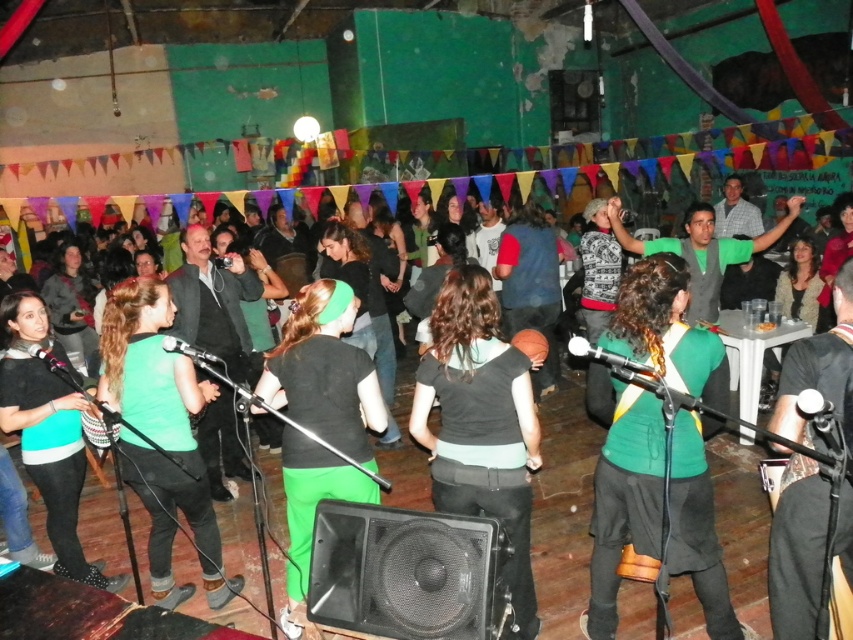
Is green fabric shirt at center shorter than black matte shirt at center?

Result: Yes.

Can you confirm if green fabric shirt at center is smaller than black matte shirt at center?

Incorrect, green fabric shirt at center is not smaller in size than black matte shirt at center.

Between point (538, 593) and point (463, 278), which one is positioned in front?

Point (463, 278) is more forward.

Locate an element on the screen. The image size is (853, 640). green fabric shirt at center is located at coordinates (563, 508).

Does black matte shirt at center appear on the left side of green matte/black t-shirt at center?

In fact, black matte shirt at center is to the right of green matte/black t-shirt at center.

The image size is (853, 640). What do you see at coordinates (480, 422) in the screenshot?
I see `black matte shirt at center` at bounding box center [480, 422].

Where is `black matte shirt at center`? The image size is (853, 640). black matte shirt at center is located at coordinates (480, 422).

Which is behind, point (596, 374) or point (540, 465)?

Positioned behind is point (540, 465).

Does green matte shirt at center appear under black matte shirt at center?

Correct, green matte shirt at center is located below black matte shirt at center.

What do you see at coordinates (622, 490) in the screenshot? The width and height of the screenshot is (853, 640). I see `green matte shirt at center` at bounding box center [622, 490].

Find the location of a particular element. The width and height of the screenshot is (853, 640). green matte shirt at center is located at coordinates (622, 490).